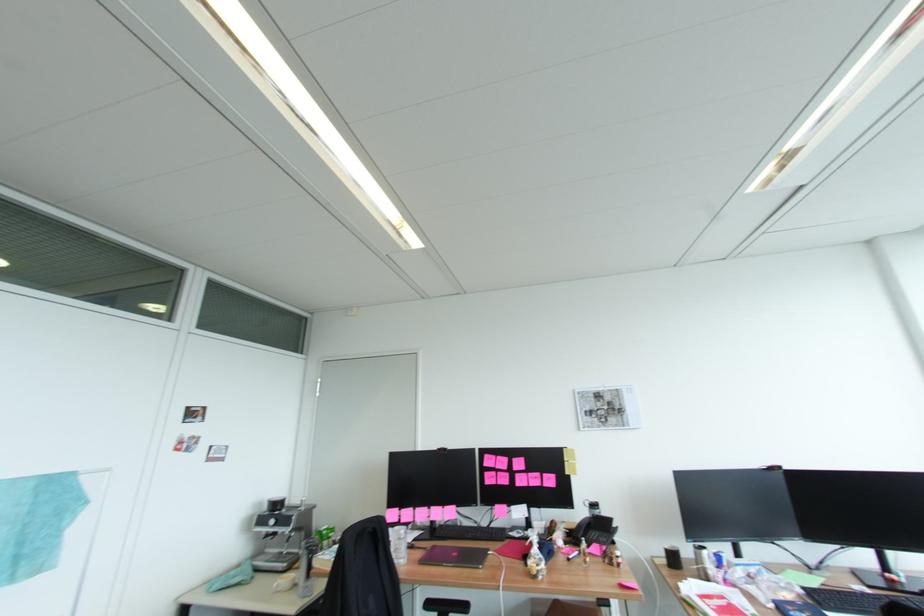
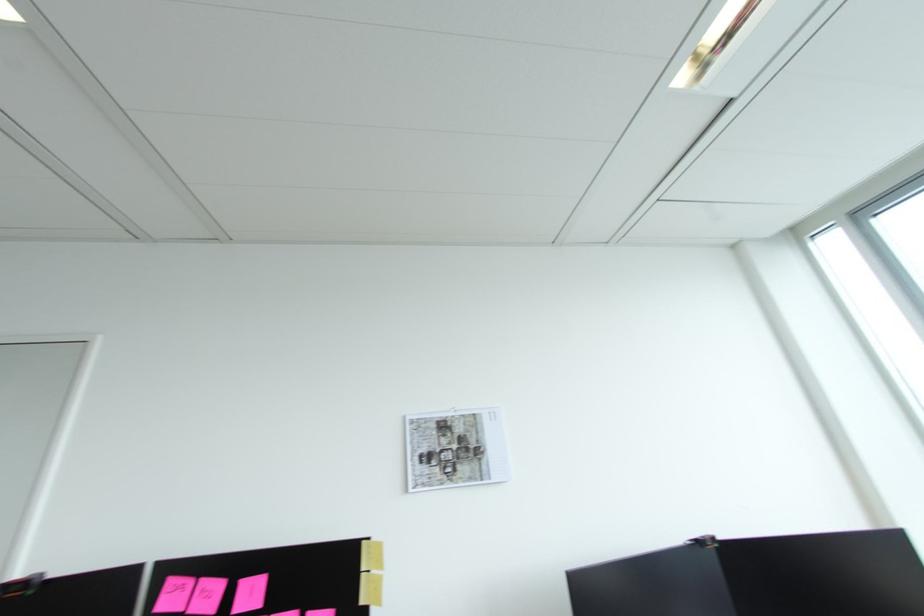
In a continuous first-person perspective shot, in which direction is the camera moving?

The movement direction of the cameraman is right, forward.